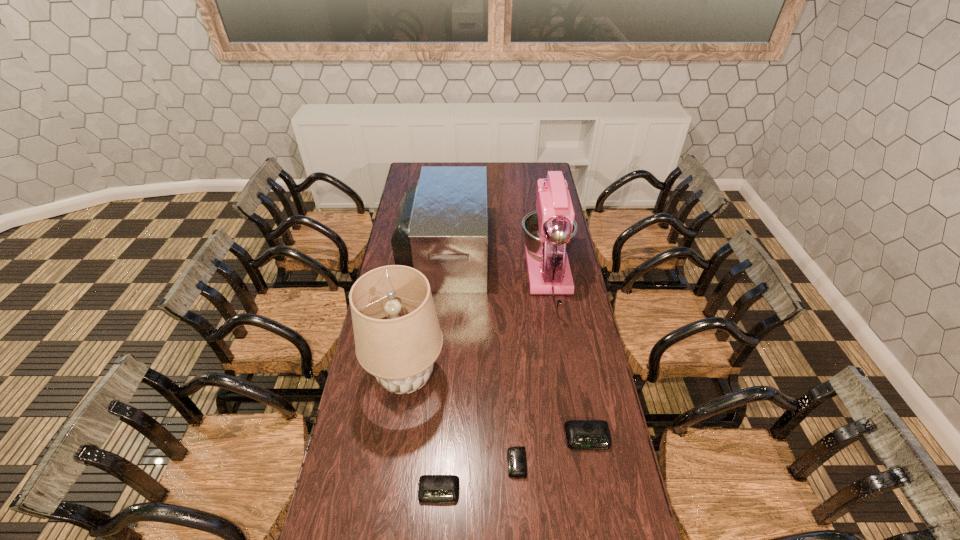
Find the location of a particular element. This screenshot has width=960, height=540. vacant space positioned 0.300m on the display of the second alarm clock from right to left is located at coordinates (413, 463).

Identify the location of vacant area located on the display of the second alarm clock from right to left. (463, 463).

You are a GUI agent. You are given a task and a screenshot of the screen. Output one action in this format:
    pyautogui.click(x=<x>, y=<y>)
    Task: Click on the vacant area located 0.230m on the display of the rightmost alarm clock
    
    Given the screenshot: What is the action you would take?
    pyautogui.click(x=605, y=529)

At what (x,y) coordinates should I click in order to perform the action: click on free point located 0.260m on the front-facing side of the microwave oven. Please return your answer as a coordinate pair (x, y). The image size is (960, 540). Looking at the image, I should click on (540, 252).

This screenshot has height=540, width=960. Identify the location of vacant space located on the face of the mixer. (538, 209).

Identify the location of free location located 0.230m on the face of the mixer. Image resolution: width=960 pixels, height=540 pixels. (539, 214).

Identify the location of free space located 0.110m on the face of the mixer. (540, 228).

Locate an element on the screen. The height and width of the screenshot is (540, 960). vacant space located on the front of the third farthest object is located at coordinates (393, 468).

Locate an element on the screen. object located in the near edge section of the desktop is located at coordinates (433, 489).

You are a GUI agent. You are given a task and a screenshot of the screen. Output one action in this format:
    pyautogui.click(x=<x>, y=<y>)
    Task: Click on the microwave oven that is at the left edge
    Image resolution: width=960 pixels, height=540 pixels.
    Given the screenshot: What is the action you would take?
    pyautogui.click(x=441, y=230)